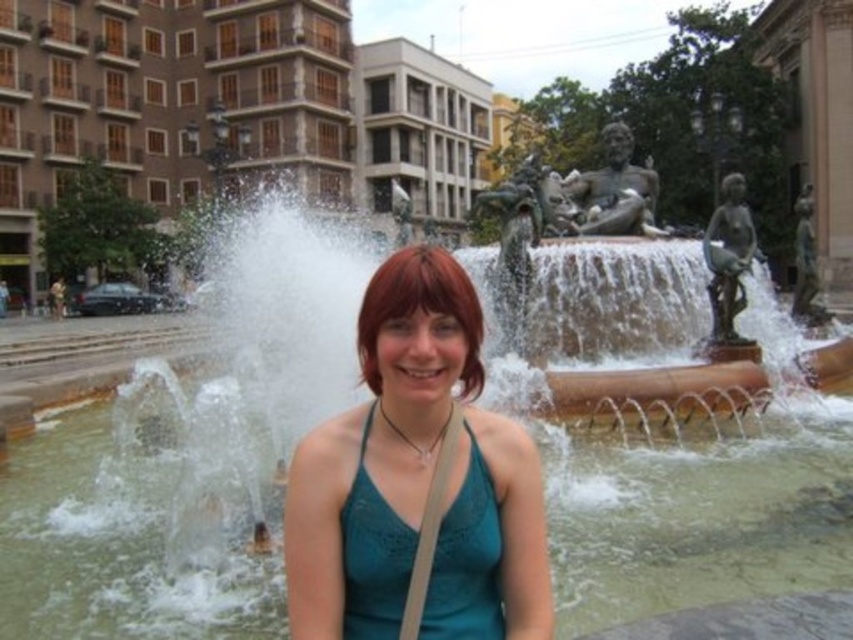
Who is more distant from viewer, (78, 424) or (357, 528)?

The point (78, 424) is more distant.

Describe the element at coordinates (699, 515) in the screenshot. I see `clear water at center` at that location.

You are a GUI agent. You are given a task and a screenshot of the screen. Output one action in this format:
    pyautogui.click(x=<x>, y=<y>)
    Task: Click on the clear water at center
    This screenshot has height=640, width=853.
    Given the screenshot: What is the action you would take?
    pyautogui.click(x=699, y=515)